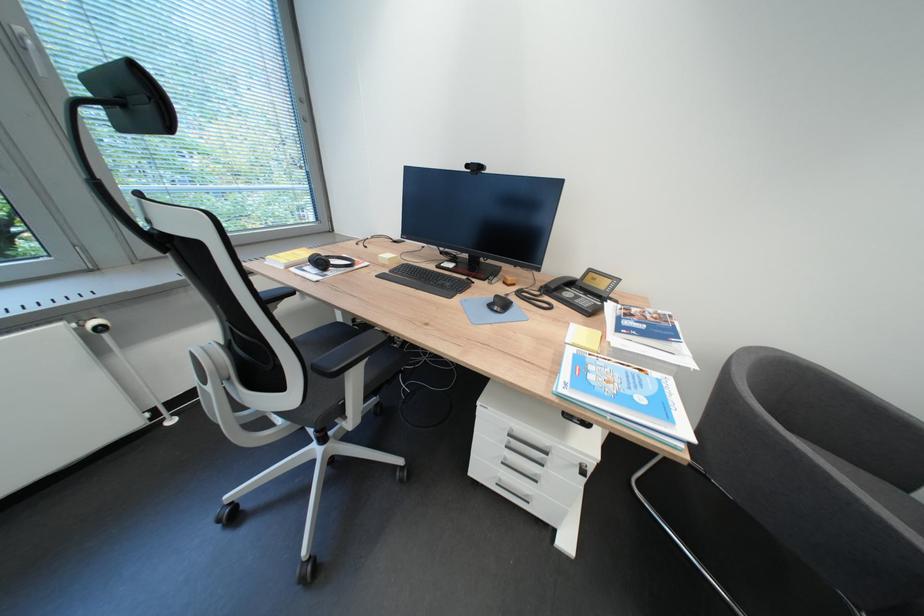
This screenshot has width=924, height=616. What do you see at coordinates (585, 302) in the screenshot? I see `the telephone handset` at bounding box center [585, 302].